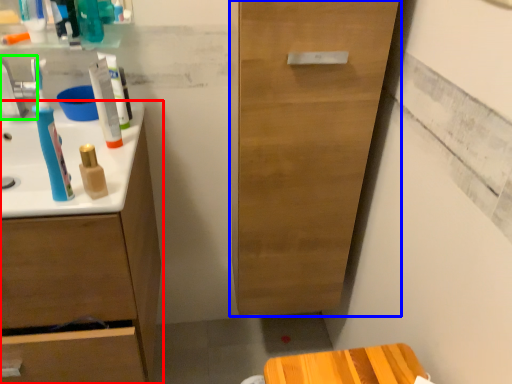
Question: Which object is positioned closest to bathroom cabinet (highlighted by a red box)? Select from cabinetry (highlighted by a blue box) and faucet (highlighted by a green box).

Choices:
 (A) cabinetry
 (B) faucet

Answer: (B)